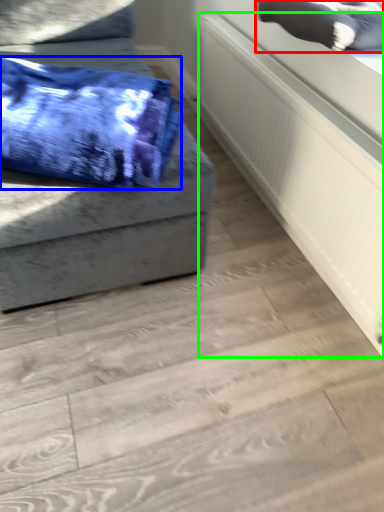
Question: Which is nearer to the pillow (highlighted by a red box)? blanket (highlighted by a blue box) or radiator (highlighted by a green box).

Choices:
 (A) blanket
 (B) radiator

Answer: (B)